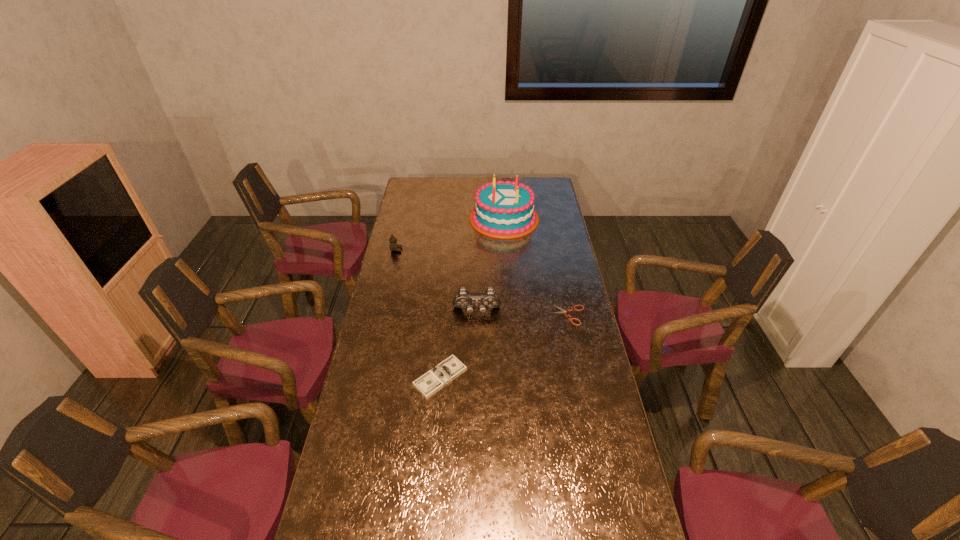
Identify the location of empty space that is in between the second tallest object and the birthday cake. (491, 265).

This screenshot has width=960, height=540. Find the location of `free area in between the leftmost object and the control`. free area in between the leftmost object and the control is located at coordinates (437, 281).

Where is `free spot between the control and the dollar`? free spot between the control and the dollar is located at coordinates (459, 345).

The image size is (960, 540). In order to click on empty space that is in between the shortest object and the second tallest object in this screenshot , I will do `click(523, 314)`.

Identify which object is the closest to the second tallest object. Please provide its 2D coordinates. Your answer should be formatted as a tuple, i.e. [(x, y)], where the tuple contains the x and y coordinates of a point satisfying the conditions above.

[(429, 383)]

The image size is (960, 540). Identify the location of object that can be found as the second closest to the teddy bear. (463, 299).

Identify the location of vacant space that satisfies the following two spatial constraints: 1. on the back side of the dollar; 2. on the right side of the farthest object. This screenshot has height=540, width=960. (453, 218).

Where is `vacant region that satisfies the following two spatial constraints: 1. on the face of the teddy bear; 2. on the right side of the shortest object`? vacant region that satisfies the following two spatial constraints: 1. on the face of the teddy bear; 2. on the right side of the shortest object is located at coordinates (381, 315).

Identify the location of vacant space that satisfies the following two spatial constraints: 1. on the back side of the shears; 2. on the right side of the dollar. This screenshot has height=540, width=960. (445, 315).

Locate an element on the screen. The width and height of the screenshot is (960, 540). free location that satisfies the following two spatial constraints: 1. on the face of the second shortest object; 2. on the left side of the leftmost object is located at coordinates (367, 377).